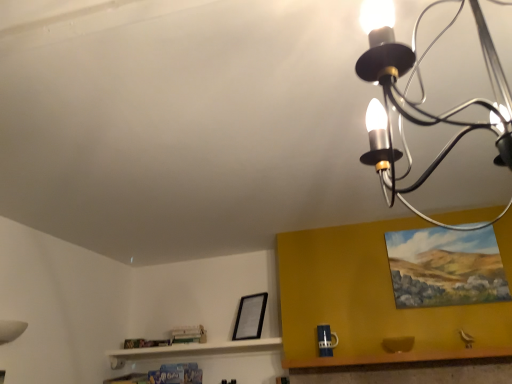
Question: Is black metal chandelier at upper right inside the boundaries of oil painting at upper right, which ranks as the 1th picture frame in right-to-left order, or outside?

Choices:
 (A) inside
 (B) outside

Answer: (B)

Question: In the image, is black metal chandelier at upper right on the left side or the right side of oil painting at upper right, acting as the 1th picture frame starting from the front?

Choices:
 (A) right
 (B) left

Answer: (B)

Question: Which object is positioned farthest from the wooden table at lower right?

Choices:
 (A) oil painting at upper right, the second picture frame from the bottom
 (B) black matte picture frame at lower center, the 1th picture frame when ordered from back to front
 (C) black metal chandelier at upper right

Answer: (C)

Question: Based on their relative distances, which object is farther from the black metal chandelier at upper right?

Choices:
 (A) black matte picture frame at lower center, the 1th picture frame when ordered from back to front
 (B) oil painting at upper right, which ranks as the 1th picture frame in right-to-left order
 (C) wooden table at lower right

Answer: (A)